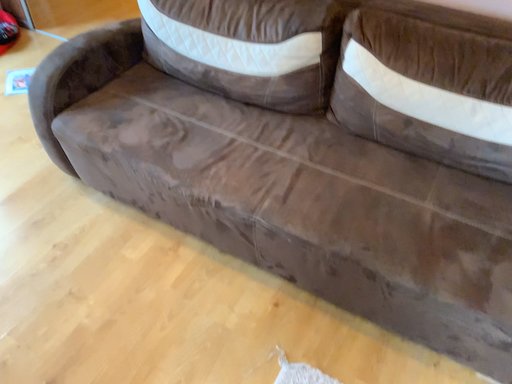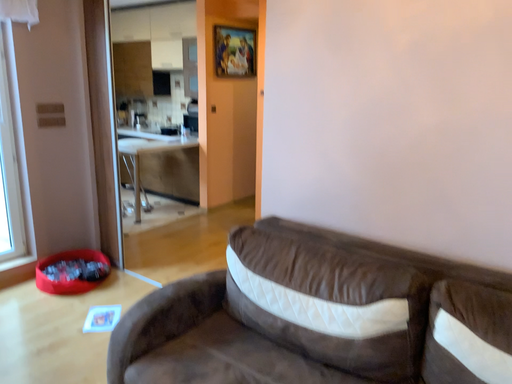
Question: How did the camera likely rotate when shooting the video?

Choices:
 (A) rotated downward
 (B) rotated upward

Answer: (B)